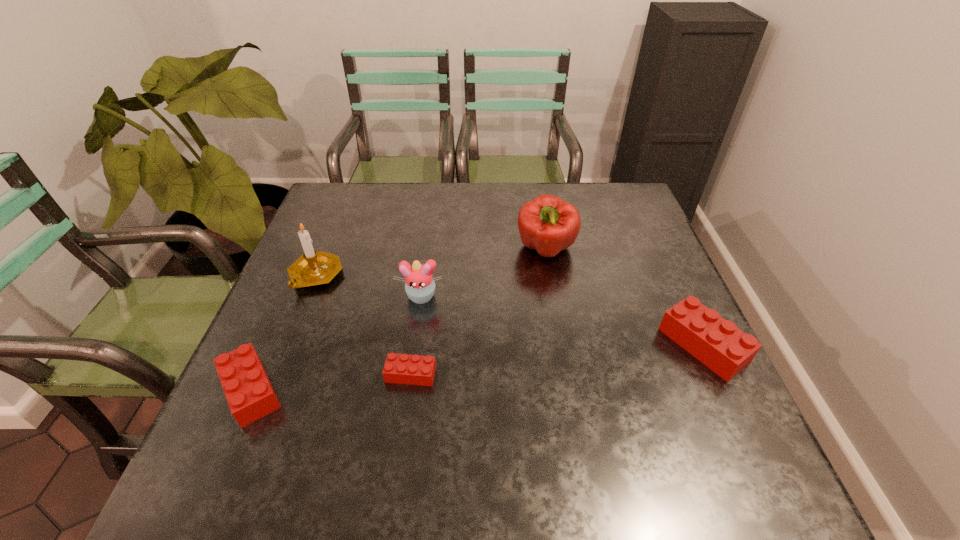
At what (x,y) coordinates should I click in order to perform the action: click on free space in the image that satisfies the following two spatial constraints: 1. on the back side of the second Lego from left to right; 2. on the left side of the rightmost Lego. Please return your answer as a coordinate pair (x, y). Looking at the image, I should click on (415, 345).

Find the location of a particular element. The image size is (960, 540). vacant space that satisfies the following two spatial constraints: 1. on the front side of the rightmost object; 2. on the left side of the bell pepper is located at coordinates (563, 345).

Find the location of a particular element. The width and height of the screenshot is (960, 540). free space that satisfies the following two spatial constraints: 1. on the back side of the rightmost Lego; 2. on the left side of the second Lego from left to right is located at coordinates (415, 345).